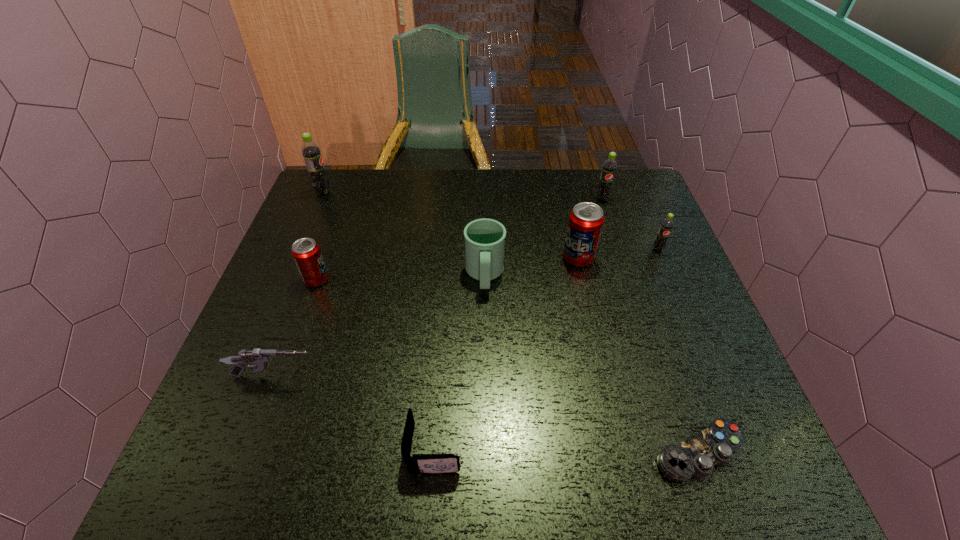
In order to click on free spot located on the back of the second soda can from left to right in this screenshot , I will do `click(331, 238)`.

Image resolution: width=960 pixels, height=540 pixels. What are the coordinates of `free region located 0.310m at the barrel of the gun` in the screenshot? It's located at (468, 376).

Identify the location of vacant area located 0.220m on the outer surface of the second shortest object. Image resolution: width=960 pixels, height=540 pixels. (582, 448).

Where is `free space located 0.250m on the back of the shortest object`? free space located 0.250m on the back of the shortest object is located at coordinates (653, 320).

You are a GUI agent. You are given a task and a screenshot of the screen. Output one action in this format:
    pyautogui.click(x=<x>, y=<y>)
    Task: Click on the wallet located in the near edge section of the desktop
    Image resolution: width=960 pixels, height=540 pixels.
    Given the screenshot: What is the action you would take?
    pyautogui.click(x=417, y=463)

Identify the location of control present at the near edge. The image size is (960, 540). (698, 455).

Where is `gun positioned at the left edge`? This screenshot has height=540, width=960. gun positioned at the left edge is located at coordinates (260, 358).

You are a GUI agent. You are given a task and a screenshot of the screen. Output one action in this format:
    pyautogui.click(x=<x>, y=<y>)
    Task: Click on the control that is at the right edge
    The height and width of the screenshot is (540, 960).
    Given the screenshot: What is the action you would take?
    pyautogui.click(x=698, y=455)

At what (x,y) coordinates should I click in order to perform the action: click on object present at the far left corner. Please return your answer as a coordinate pair (x, y). Looking at the image, I should click on (311, 152).

Where is `object located in the far right corner section of the desktop`? The image size is (960, 540). object located in the far right corner section of the desktop is located at coordinates (609, 167).